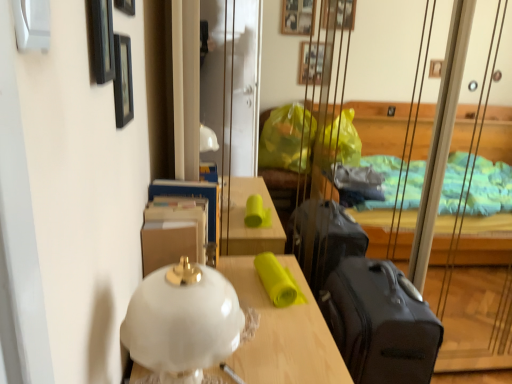
Question: From a real-world perspective, is wooden picture frame at upper left, which is the 2th picture frame from front to back, above or below black matte picture frame at upper left, which appears as the first picture frame when viewed from the front?

Choices:
 (A) above
 (B) below

Answer: (A)

Question: Visually, is wooden picture frame at upper left, which is the 2th picture frame from front to back, positioned to the left or to the right of black matte picture frame at upper left, which appears as the first picture frame when viewed from the front?

Choices:
 (A) right
 (B) left

Answer: (B)

Question: Based on their relative distances, which object is nearer to the black matte picture frame at upper left, which is counted as the first picture frame, starting from the back?

Choices:
 (A) white matte lampshade at center
 (B) black matte picture frame at upper left, which appears as the first picture frame when viewed from the front
 (C) black smooth suitcase at right
 (D) white glass lamp at center
 (E) wooden picture frame at upper left, which is the 2th picture frame from front to back

Answer: (B)

Question: Based on their relative distances, which object is nearer to the black matte picture frame at upper left, which appears as the first picture frame when viewed from the front?

Choices:
 (A) black smooth suitcase at right
 (B) wooden picture frame at upper left, which is counted as the second picture frame, starting from the back
 (C) black matte picture frame at upper left, positioned as the third picture frame in front-to-back order
 (D) white matte lampshade at center
 (E) white glass lamp at center

Answer: (C)